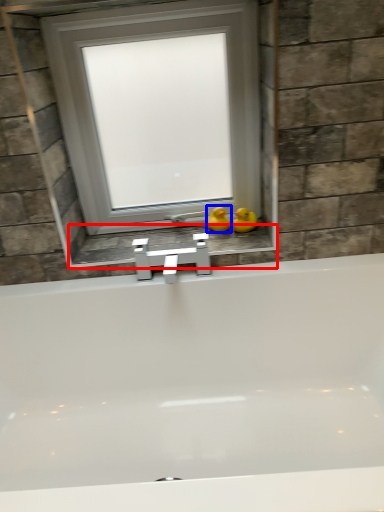
Question: Which of the following is the closest to the observer, window sill (highlighted by a red box) or duck (highlighted by a blue box)?

Choices:
 (A) window sill
 (B) duck

Answer: (A)